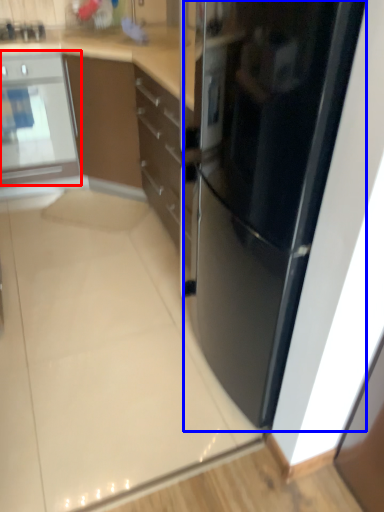
Question: Which of the following is the closest to the observer, home appliance (highlighted by a red box) or refrigerator (highlighted by a blue box)?

Choices:
 (A) home appliance
 (B) refrigerator

Answer: (B)